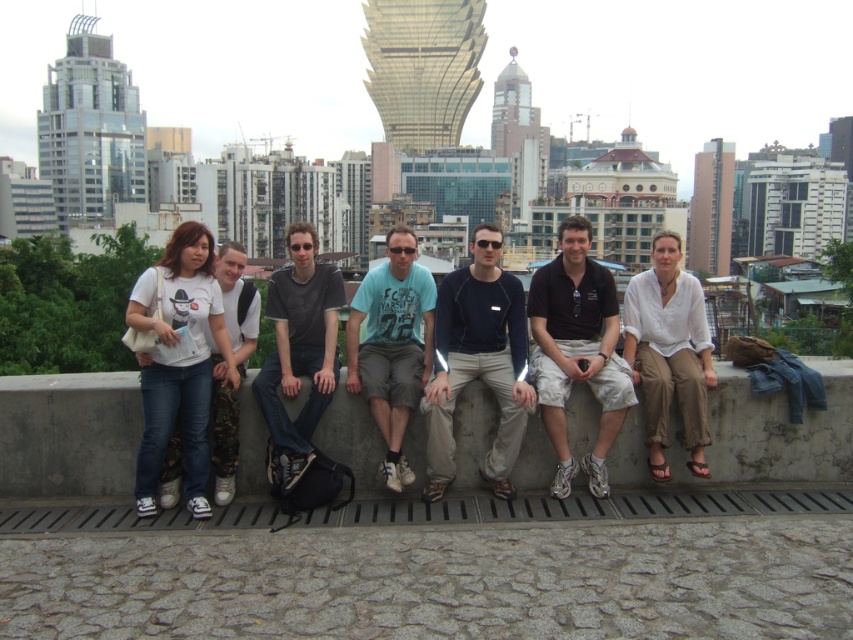
Does point (529, 316) lie in front of point (415, 381)?

No, (529, 316) is behind (415, 381).

Is point (592, 376) farther from viewer compared to point (430, 346)?

No, it is in front of (430, 346).

The width and height of the screenshot is (853, 640). Identify the location of dark brown leather shorts at center. (577, 349).

Locate an element on the screen. dark brown leather shorts at center is located at coordinates (577, 349).

Is point (292, 480) farther from viewer compared to point (241, 244)?

No, (292, 480) is closer to viewer.

Is dark gray t-shirt at center wider than camo fabric pants at left?

Yes.

The width and height of the screenshot is (853, 640). Describe the element at coordinates (299, 349) in the screenshot. I see `dark gray t-shirt at center` at that location.

I want to click on dark gray t-shirt at center, so click(x=299, y=349).

Does light blue t-shirt at center appear under dark gray t-shirt at center?

Indeed, light blue t-shirt at center is positioned under dark gray t-shirt at center.

Who is lower down, light blue t-shirt at center or dark gray t-shirt at center?

light blue t-shirt at center

Between point (392, 232) and point (312, 392), which one is positioned in front?

Positioned in front is point (312, 392).

Find the location of a particular element. This screenshot has width=853, height=640. light blue t-shirt at center is located at coordinates (392, 346).